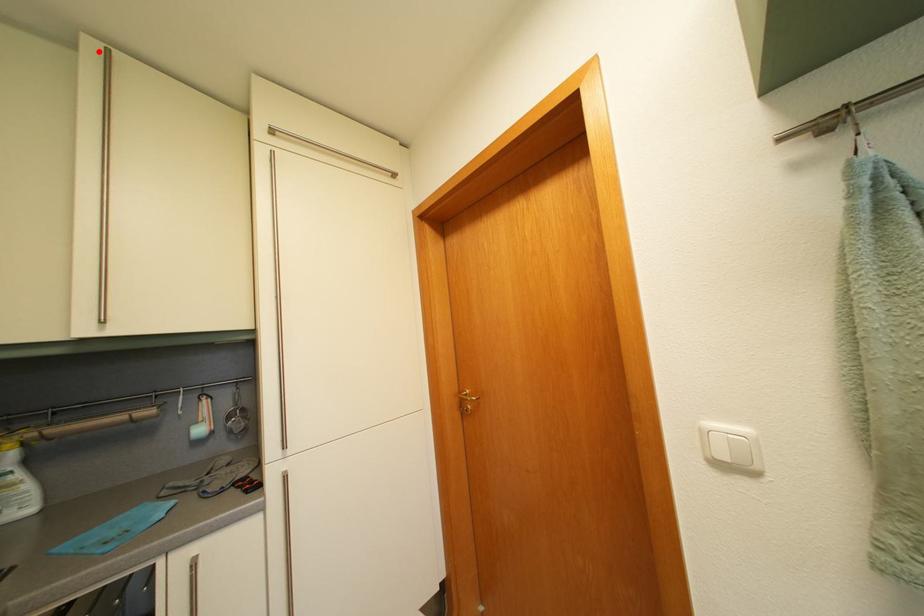
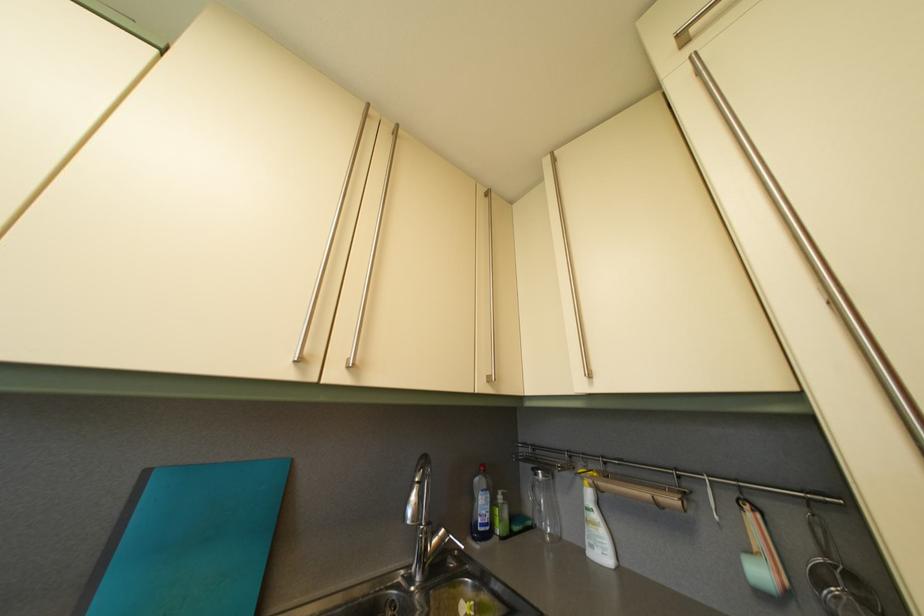
Where in the second image is the point corresponding to the highlighted location from the first image?

(554, 169)